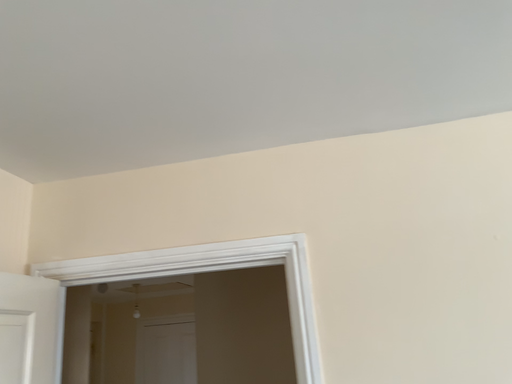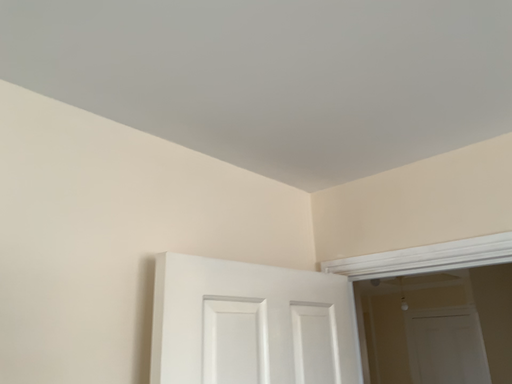
Question: How did the camera likely rotate when shooting the video?

Choices:
 (A) rotated left
 (B) rotated right

Answer: (A)